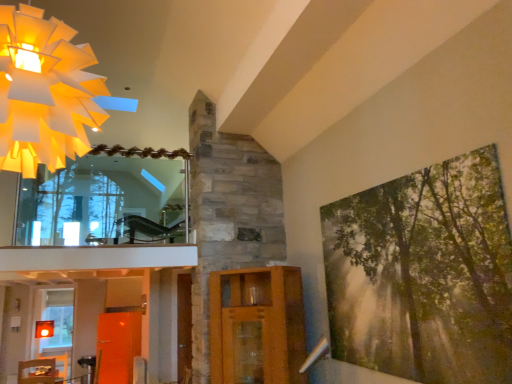
Question: Is clear glass mirror at upper left to the left or to the right of translucent glass window at lower left in the image?

Choices:
 (A) right
 (B) left

Answer: (A)

Question: Is clear glass mirror at upper left wider or thinner than translucent glass window at lower left?

Choices:
 (A) wide
 (B) thin

Answer: (B)

Question: Which object is the farthest from the wooden table at lower left?

Choices:
 (A) translucent glass window at lower left
 (B) clear glass mirror at upper left
 (C) wooden cabinet at center
 (D) matte paper chandelier at upper left
 (E) green textured canvas at right

Answer: (D)

Question: Which object is the closest to the clear glass mirror at upper left?

Choices:
 (A) matte paper chandelier at upper left
 (B) green textured canvas at right
 (C) wooden table at lower left
 (D) translucent glass window at lower left
 (E) wooden cabinet at center

Answer: (E)